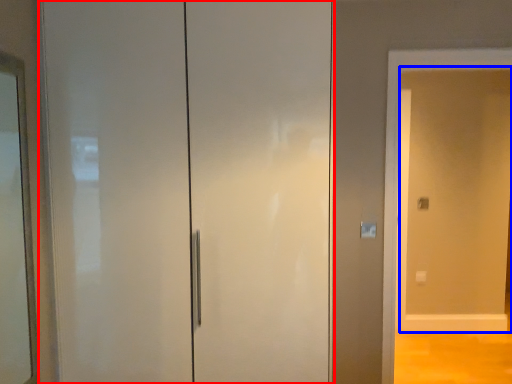
Question: Which object is closer to the camera taking this photo, door (highlighted by a red box) or screen door (highlighted by a blue box)?

Choices:
 (A) door
 (B) screen door

Answer: (A)